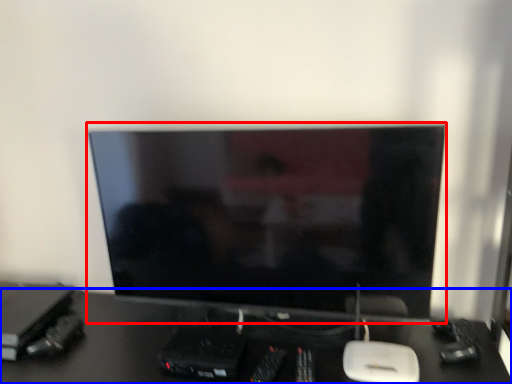
Question: Among these objects, which one is farthest to the camera, computer monitor (highlighted by a red box) or desk (highlighted by a blue box)?

Choices:
 (A) computer monitor
 (B) desk

Answer: (A)